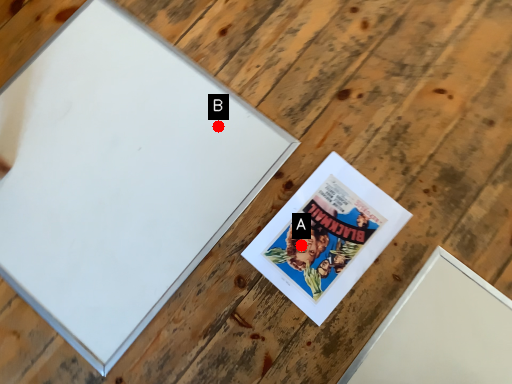
Question: Two points are circled on the image, labeled by A and B beside each circle. Which point appears farthest from the camera in this image?

Choices:
 (A) A is further
 (B) B is further

Answer: (B)